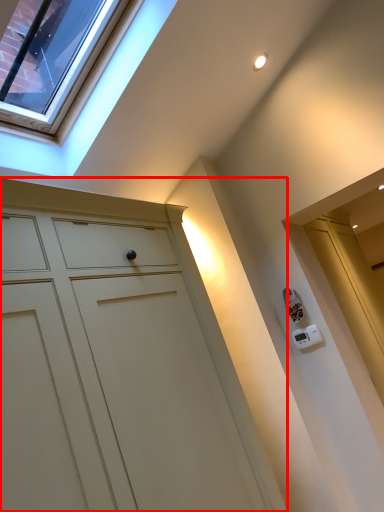
Question: From the image's perspective, what is the correct spatial positioning of cupboard (annotated by the red box) in reference to glass door?

Choices:
 (A) above
 (B) below

Answer: (B)